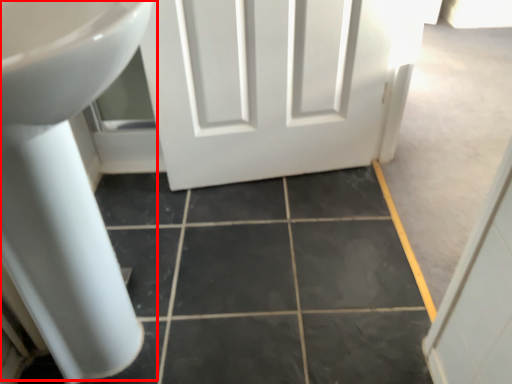
Question: Observing the image, what is the correct spatial positioning of sink (annotated by the red box) in reference to ceramic tile?

Choices:
 (A) right
 (B) left

Answer: (B)